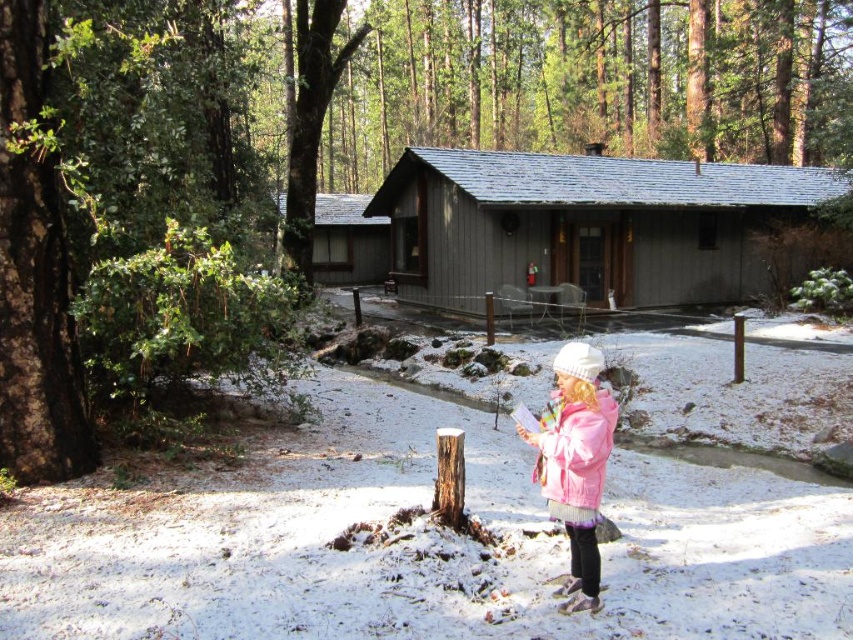
Question: Observing the image, what is the correct spatial positioning of gray wood cabin at center in reference to pink fleece jacket at lower right?

Choices:
 (A) below
 (B) above

Answer: (B)

Question: Can you confirm if gray wood cabin at center is positioned below pink fuzzy jacket at lower right?

Choices:
 (A) yes
 (B) no

Answer: (B)

Question: Considering the real-world distances, which object is farthest from the pink fuzzy jacket at lower right?

Choices:
 (A) pink fleece jacket at lower right
 (B) gray wood cabin at center
 (C) wooden cabin at center

Answer: (C)

Question: Is pink fleece jacket at lower right to the left of pink fuzzy jacket at lower right from the viewer's perspective?

Choices:
 (A) yes
 (B) no

Answer: (A)

Question: Which point is closer to the camera?

Choices:
 (A) gray wood cabin at center
 (B) pink fleece jacket at lower right

Answer: (B)

Question: Which point appears closest to the camera in this image?

Choices:
 (A) (607, 417)
 (B) (583, 497)
 (C) (387, 236)

Answer: (B)